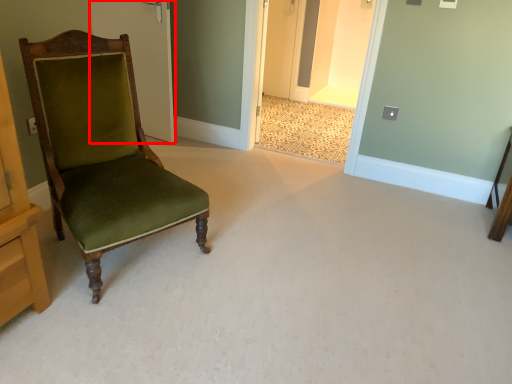
Question: From the image's perspective, what is the correct spatial relationship of door (annotated by the red box) in relation to chair?

Choices:
 (A) above
 (B) below

Answer: (A)